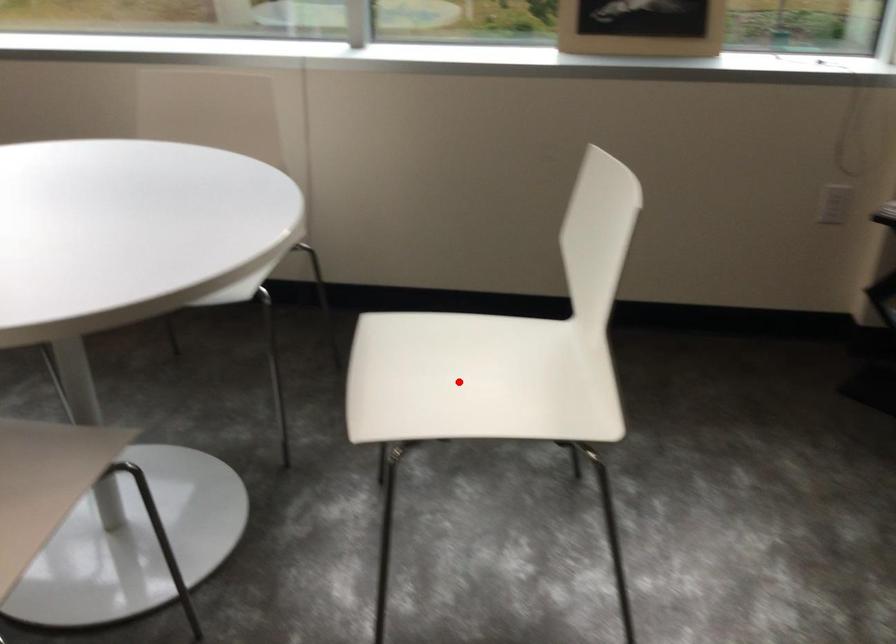
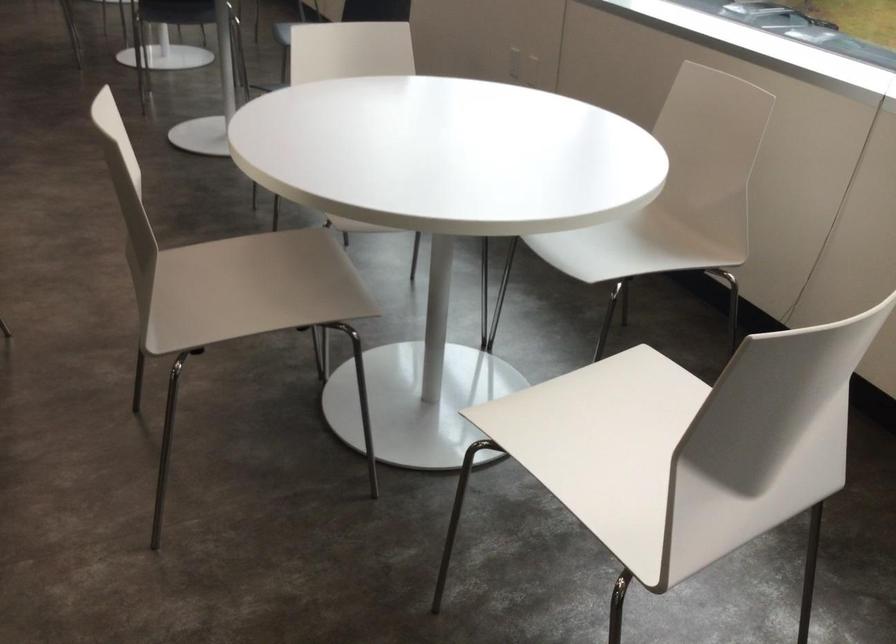
Find the pixel in the second image that matches the highlighted location in the first image.

(604, 444)